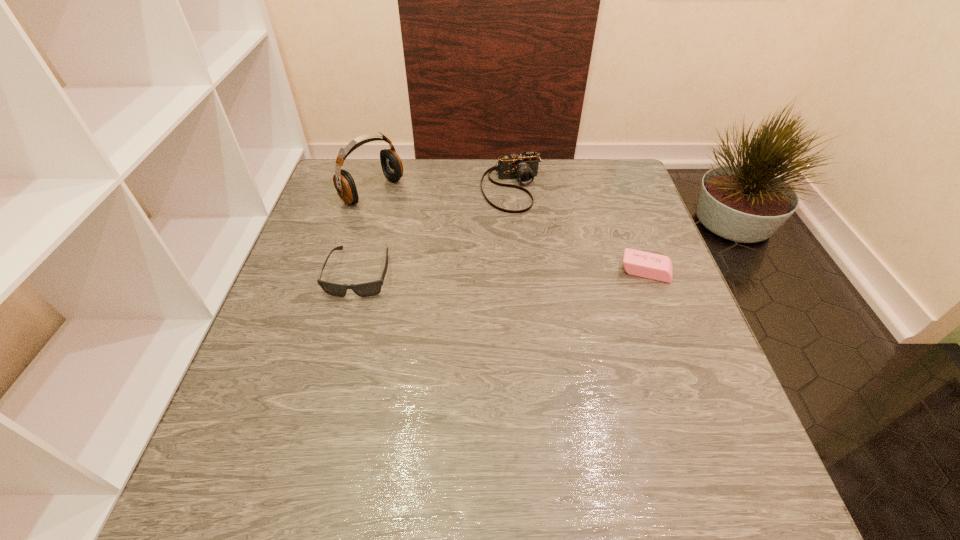
Locate an element on the screen. vacant region between the eraser and the tallest object is located at coordinates 509,231.

Where is `free space between the rightmost object and the sunglasses`? free space between the rightmost object and the sunglasses is located at coordinates (502, 272).

This screenshot has width=960, height=540. In order to click on free space between the second object from right to left and the third tallest object in this screenshot , I will do `click(436, 231)`.

Find the location of `free space between the second tallest object and the rightmost object`. free space between the second tallest object and the rightmost object is located at coordinates (579, 230).

You are a GUI agent. You are given a task and a screenshot of the screen. Output one action in this format:
    pyautogui.click(x=<x>, y=<y>)
    Task: Click on the empty location between the third object from left to right and the tallest object
    
    Given the screenshot: What is the action you would take?
    pyautogui.click(x=443, y=190)

You are a GUI agent. You are given a task and a screenshot of the screen. Output one action in this format:
    pyautogui.click(x=<x>, y=<y>)
    Task: Click on the free space between the camera and the tallest object
    This screenshot has width=960, height=540.
    Given the screenshot: What is the action you would take?
    pyautogui.click(x=443, y=190)

Locate an element on the screen. This screenshot has height=540, width=960. unoccupied position between the shortest object and the tallest object is located at coordinates (509, 231).

Choose which object is the second nearest neighbor to the sunglasses. Please provide its 2D coordinates. Your answer should be formatted as a tuple, i.e. [(x, y)], where the tuple contains the x and y coordinates of a point satisfying the conditions above.

[(524, 166)]

In order to click on object identified as the third closest to the tallest object in this screenshot , I will do `click(648, 265)`.

Where is `free space that satisfies the following two spatial constraints: 1. on the back side of the tallest object; 2. on the left side of the second tallest object`? This screenshot has width=960, height=540. free space that satisfies the following two spatial constraints: 1. on the back side of the tallest object; 2. on the left side of the second tallest object is located at coordinates (373, 188).